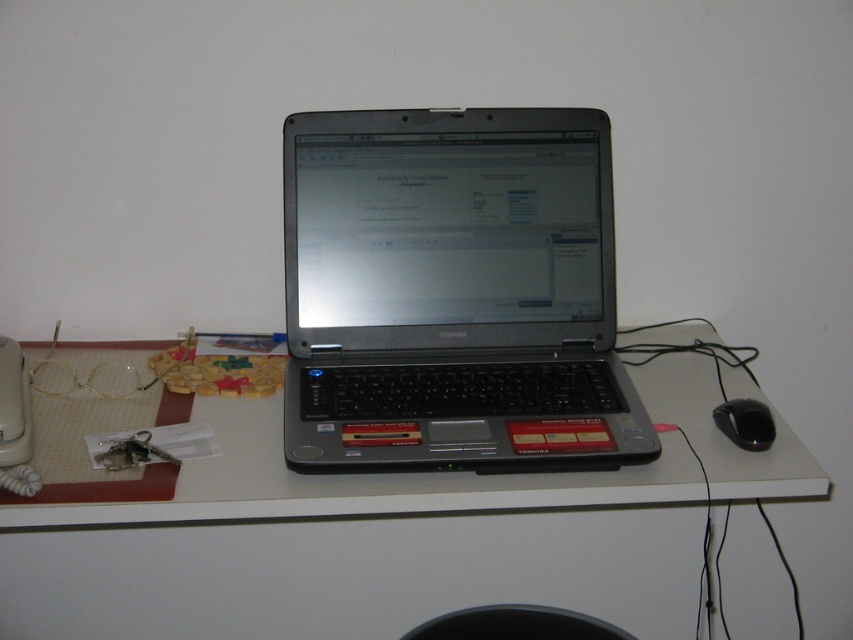
Question: Which of the following is the farthest from the observer?

Choices:
 (A) satin silver laptop at center
 (B) black plastic mouse at lower right
 (C) white matte computer desk at center
 (D) black plastic trash can at lower center

Answer: (C)

Question: Does white matte computer desk at center have a smaller size compared to black plastic mouse at lower right?

Choices:
 (A) no
 (B) yes

Answer: (A)

Question: Does white matte computer desk at center appear on the right side of satin silver laptop at center?

Choices:
 (A) no
 (B) yes

Answer: (A)

Question: Among these points, which one is farthest from the camera?

Choices:
 (A) (483, 609)
 (B) (758, 440)
 (C) (737, 477)

Answer: (A)

Question: Based on their relative distances, which object is nearer to the white matte computer desk at center?

Choices:
 (A) black plastic mouse at lower right
 (B) satin silver laptop at center
 (C) black plastic trash can at lower center

Answer: (C)

Question: Is white matte computer desk at center positioned before black plastic trash can at lower center?

Choices:
 (A) yes
 (B) no

Answer: (B)